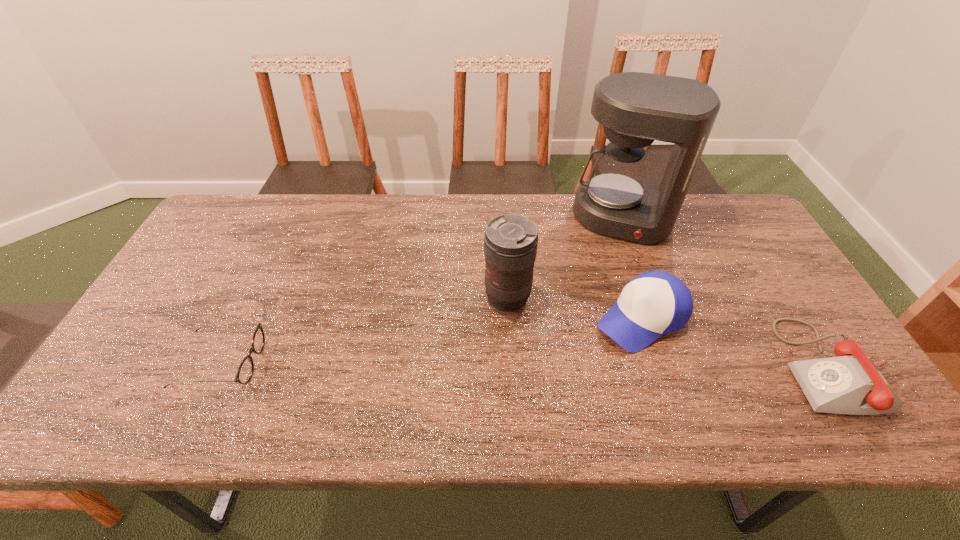
Where is `free space located 0.250m on the front-facing side of the third shortest object`? The height and width of the screenshot is (540, 960). free space located 0.250m on the front-facing side of the third shortest object is located at coordinates (531, 388).

At what (x,y) coordinates should I click in order to perform the action: click on vacant area situated on the front-facing side of the third shortest object. Please return your answer as a coordinate pair (x, y). The height and width of the screenshot is (540, 960). Looking at the image, I should click on (566, 365).

Identify the location of object present at the far edge. The height and width of the screenshot is (540, 960). (635, 108).

Find the location of `spectacles present at the near edge`. spectacles present at the near edge is located at coordinates (244, 374).

Find the location of a particular element. The height and width of the screenshot is (540, 960). telephone that is at the near edge is located at coordinates (850, 383).

Identify the location of object at the left edge. (244, 374).

The width and height of the screenshot is (960, 540). I want to click on object situated at the right edge, so click(850, 383).

Identify the location of object located at the near left corner. (244, 374).

At what (x,y) coordinates should I click in order to perform the action: click on object that is positioned at the near right corner. Please return your answer as a coordinate pair (x, y). The height and width of the screenshot is (540, 960). Looking at the image, I should click on (850, 383).

Where is `vacant area at the far edge of the desktop`? The width and height of the screenshot is (960, 540). vacant area at the far edge of the desktop is located at coordinates (350, 224).